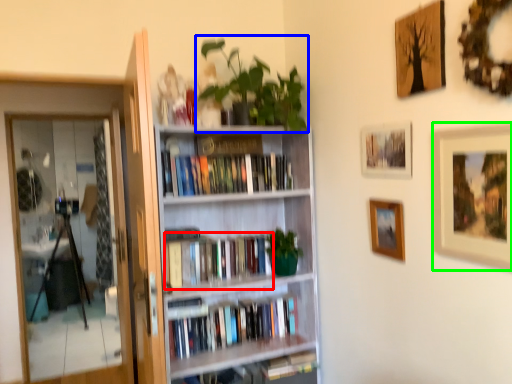
Question: Estimate the real-world distances between objects in this image. Which object is closer to book (highlighted by a red box), plant (highlighted by a blue box) or picture frame (highlighted by a green box)?

Choices:
 (A) plant
 (B) picture frame

Answer: (A)